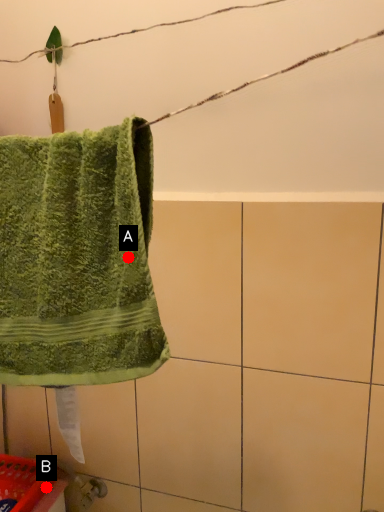
Question: Two points are circled on the image, labeled by A and B beside each circle. Among these points, which one is nearest to the camera?

Choices:
 (A) A is closer
 (B) B is closer

Answer: (A)